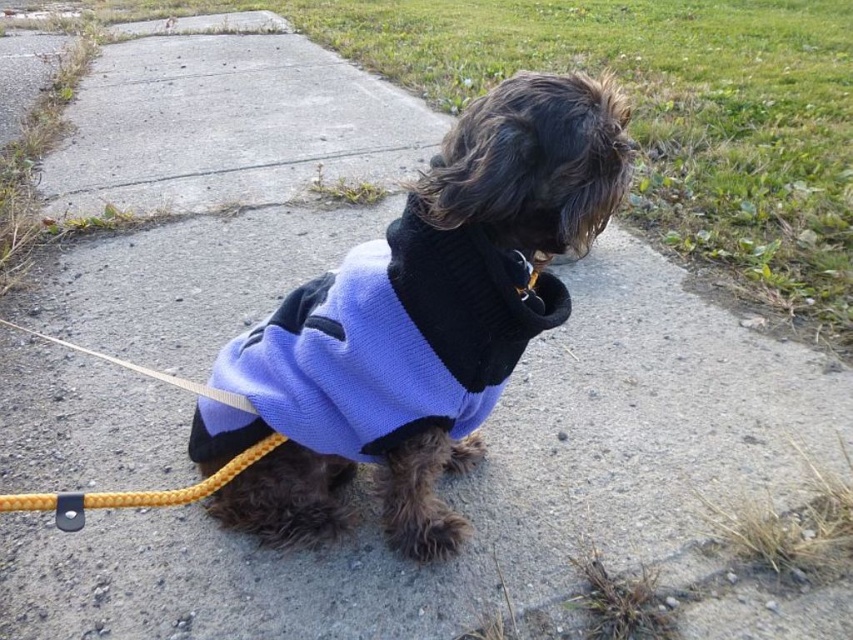
You are a dog owner trying to measure the distance between your dog wearing the knitted blue sweater at center and the yellow braided rope leash at lower left to ensure safety. Can you confirm if the distance is within a 15 inch safety limit?

The distance between the knitted blue sweater at center and the yellow braided rope leash at lower left is 14.28 inches, which is within the 15 inch safety limit.

You are a dog owner trying to decide if your dog can comfortably wear its knitted blue sweater at center while walking on the path. Considering the width of the yellow braided rope leash at lower left, do you think the sweater might be too wide for the leash to manage comfortably?

The knitted blue sweater at center might be wider than yellow braided rope leash at lower left, so there is a possibility that the sweater could be too wide for the leash to manage comfortably, potentially causing some difficulty in controlling the dog during walks.